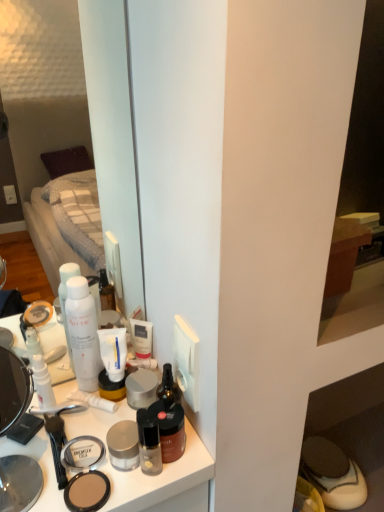
Where is `unoccupied area in front of white matte spray can at center, the third toiletry in the right-to-left sequence`? Image resolution: width=384 pixels, height=512 pixels. unoccupied area in front of white matte spray can at center, the third toiletry in the right-to-left sequence is located at coordinates (70, 448).